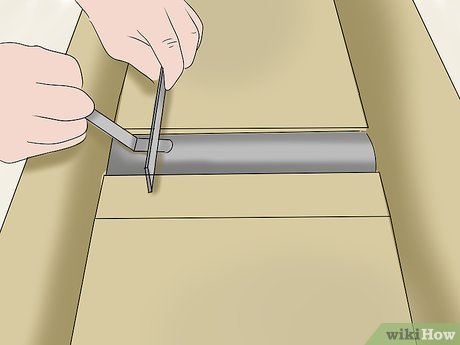
This screenshot has height=345, width=460. I want to click on box, so click(255, 196).